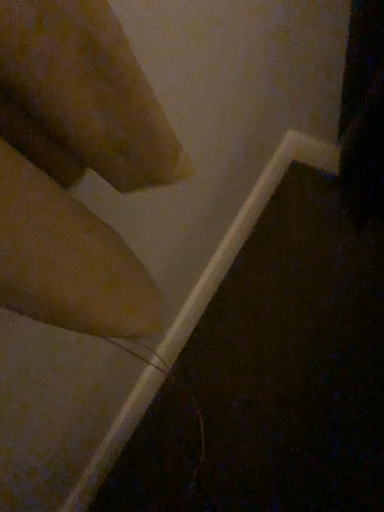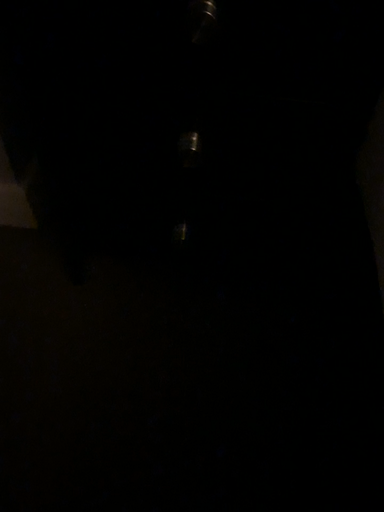
Question: How did the camera likely rotate when shooting the video?

Choices:
 (A) rotated right
 (B) rotated left

Answer: (A)